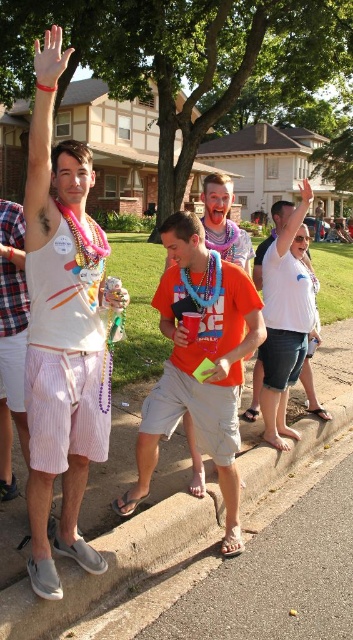
Can you confirm if striped cotton shorts at left is smaller than blue beaded necklace at center?

No.

Does striped cotton shorts at left have a lesser height compared to blue beaded necklace at center?

No, striped cotton shorts at left is not shorter than blue beaded necklace at center.

Describe the element at coordinates (12, 340) in the screenshot. This screenshot has height=640, width=353. I see `striped cotton shorts at left` at that location.

Find the location of `striped cotton shorts at left`. striped cotton shorts at left is located at coordinates (12, 340).

Does orange cotton t-shirt at center have a smaller size compared to white matte hand at upper left?

Correct, orange cotton t-shirt at center occupies less space than white matte hand at upper left.

Does orange cotton t-shirt at center lie in front of white matte hand at upper left?

No, orange cotton t-shirt at center is behind white matte hand at upper left.

At what (x,y) coordinates should I click in order to perform the action: click on orange cotton t-shirt at center. Please return your answer as a coordinate pair (x, y). The height and width of the screenshot is (640, 353). Looking at the image, I should click on (200, 364).

In order to click on orange cotton t-shirt at center in this screenshot , I will do `click(200, 364)`.

Which is in front, point (122, 296) or point (175, 330)?

Point (122, 296) is in front.

Looking at this image, which of these two, metallic silver can at center or matte plastic cup at center, stands taller?

matte plastic cup at center

Which is in front, point (110, 298) or point (183, 332)?

Point (110, 298) is more forward.

Where is `metallic silver can at center`? metallic silver can at center is located at coordinates (117, 298).